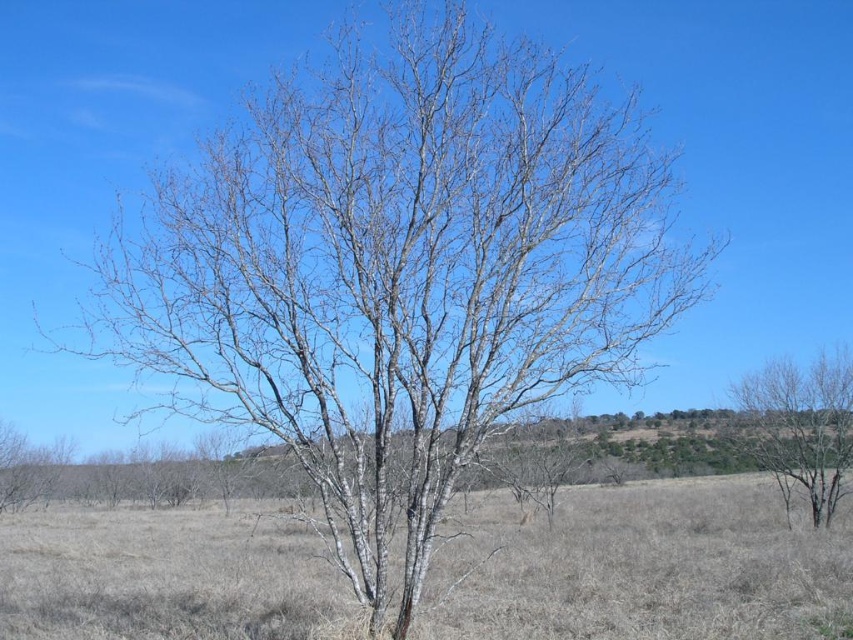
Which is in front, point (782, 568) or point (791, 369)?

Point (782, 568)

Who is taller, dry grass at center or bare wood tree at right?

dry grass at center is taller.

Measure the distance between point (97, 596) and camera.

Point (97, 596) is 10.67 meters from camera.

Where is `dry grass at center`? dry grass at center is located at coordinates (643, 566).